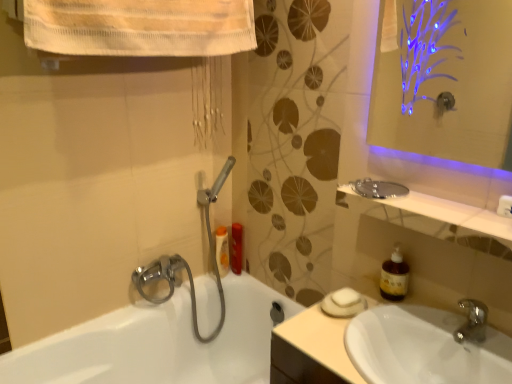
Locate an element on the screen. This screenshot has height=384, width=512. vacant space situated on the left part of white matte soap at sink is located at coordinates pos(305,321).